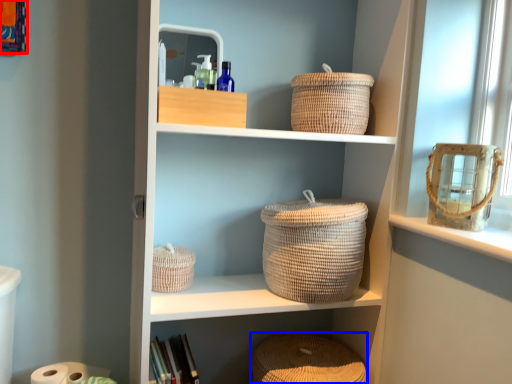
Question: Which point is closer to the camera, picture frame (highlighted by a red box) or basket (highlighted by a blue box)?

Choices:
 (A) picture frame
 (B) basket

Answer: (A)